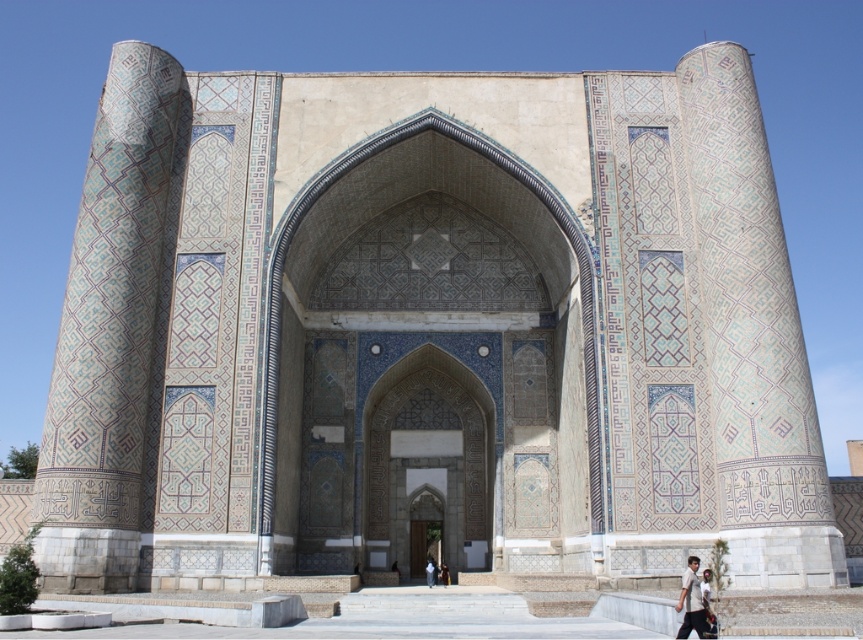
Is point (96, 573) positioned in front of point (690, 557)?

Yes.

Does blue mosaic pillar at left have a greater height compared to light brown fabric shirt at lower right?

Yes.

Which is behind, point (95, 253) or point (698, 596)?

The point (95, 253) is more distant.

This screenshot has width=863, height=640. In order to click on blue mosaic pillar at left in this screenshot , I will do `click(108, 333)`.